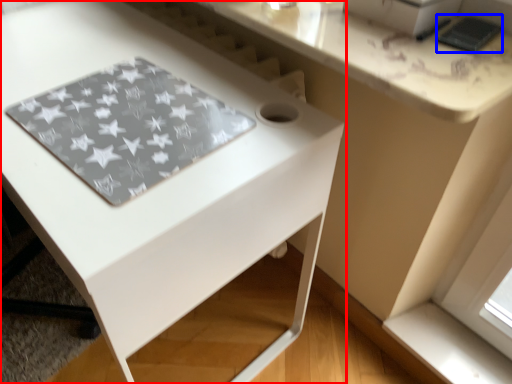
Question: Which point is further to the camera, table (highlighted by a red box) or pad (highlighted by a blue box)?

Choices:
 (A) table
 (B) pad

Answer: (B)